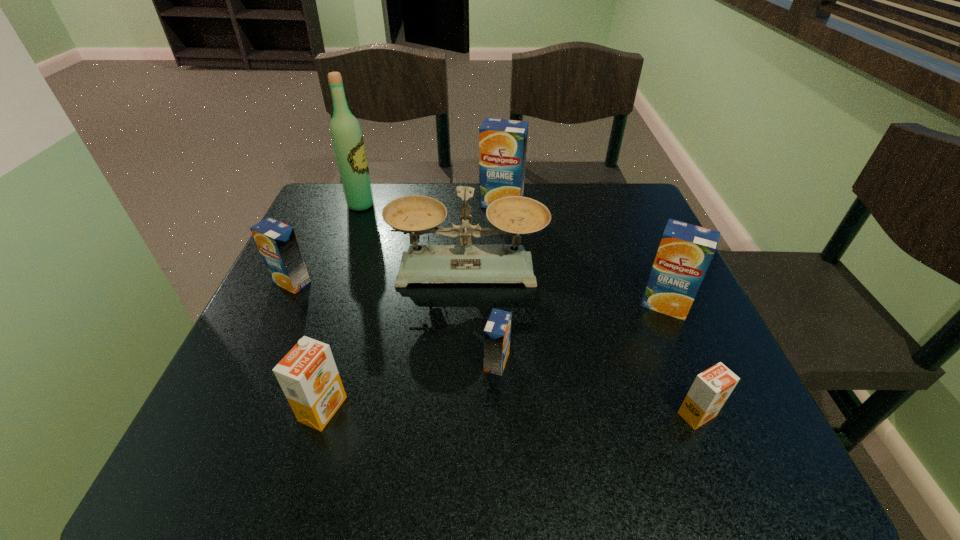
Where is `wine bottle`? This screenshot has height=540, width=960. wine bottle is located at coordinates (347, 139).

The width and height of the screenshot is (960, 540). What are the coordinates of `white wine bottle` in the screenshot? It's located at (347, 139).

Locate an element on the screen. The width and height of the screenshot is (960, 540). the farthest blue orange_juice is located at coordinates (502, 143).

Locate an element on the screen. The height and width of the screenshot is (540, 960). the tallest orange juice is located at coordinates (502, 143).

You are a GUI agent. You are given a task and a screenshot of the screen. Output one action in this format:
    pyautogui.click(x=<x>, y=<y>)
    Task: Click on the scale
    Image resolution: width=960 pixels, height=540 pixels.
    Given the screenshot: What is the action you would take?
    (x=513, y=215)

Locate an element on the screen. This screenshot has width=960, height=540. the rightmost blue orange_juice is located at coordinates (685, 251).

Identify the location of the second biggest blue orange_juice. This screenshot has width=960, height=540. (685, 251).

This screenshot has height=540, width=960. Identify the location of the leftmost object. (277, 243).

Identify the location of the second smallest blue orange_juice. (277, 243).

The height and width of the screenshot is (540, 960). I want to click on the left orange orange juice, so click(308, 376).